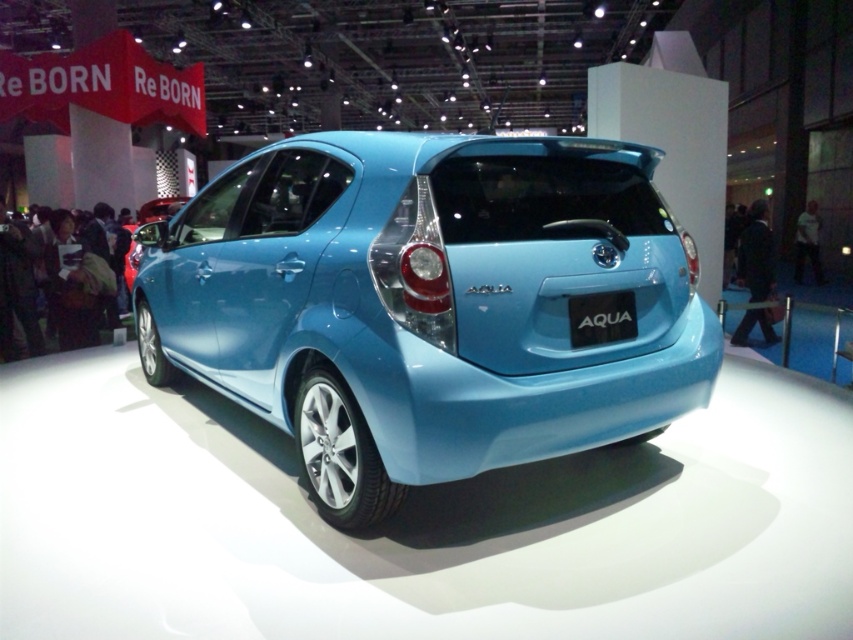
You are at an auto show and want to take a photo of the light blue metallic hatchback at center and the blue glossy license plate at rear. Which object should you focus on first if you want to capture both in the frame without moving the camera?

The light blue metallic hatchback at center is bigger than the blue glossy license plate at rear, so you should focus on the light blue metallic hatchback at center first to ensure it fits in the frame before adjusting for the smaller license plate.

You are standing at the entrance of the exhibition hall and see two points marked on the floor. The first point is at point (399,284) and the second point is at point (624,292). Which point is closer to you?

Point (399,284) is in front of point (624,292), so it is closer to you.